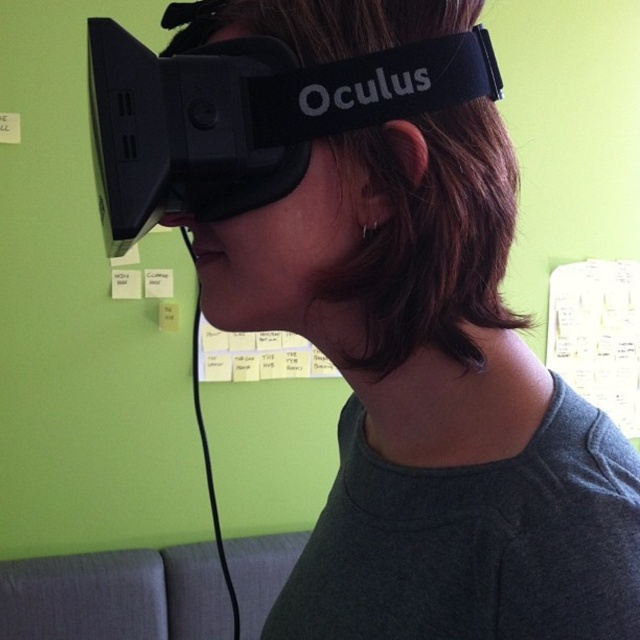
You are standing in a room with a light green wall and a person wearing an Oculus VR headset. There is a point marked at coordinates (248, 116). What object is located at that point?

The black matte vr goggles at center is located at point (248, 116).

You are a photographer trying to capture a clear shot of both the black matte vr goggles at center and the white paper notes at upper center. Since you can only focus on one object at a time, which one should you choose to ensure the other remains somewhat in focus?

The black matte vr goggles at center is closer to the viewer than the white paper notes at upper center. To keep both somewhat in focus, you should focus on the black matte vr goggles at center because it is closer, and the white paper notes at upper center will be slightly out of focus but still somewhat visible.

You are designing a storage box for the black matte vr goggles at center and the white paper notes at upper center. Which object requires a wider storage space?

The white paper notes at upper center require a wider storage space because the black matte vr goggles at center is narrower than them.